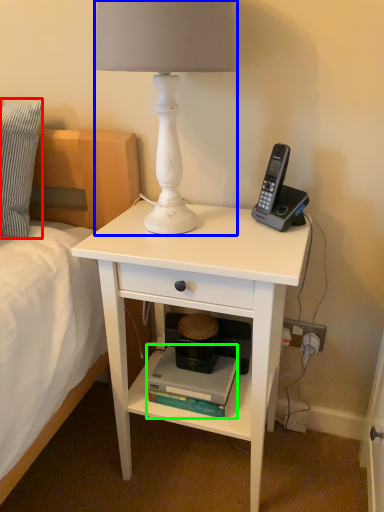
Question: Which is nearer to the pillow (highlighted by a red box)? lamp (highlighted by a blue box) or book (highlighted by a green box).

Choices:
 (A) lamp
 (B) book

Answer: (A)